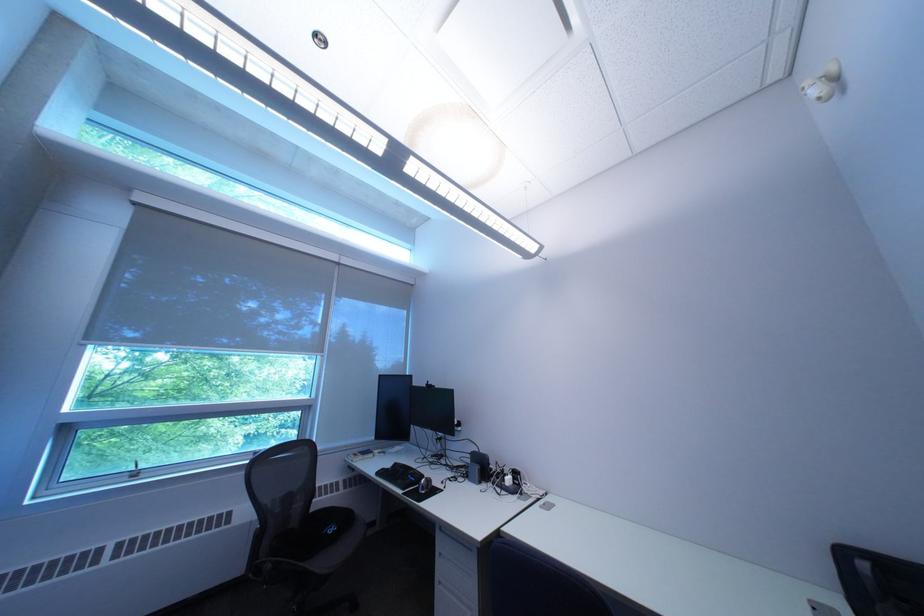
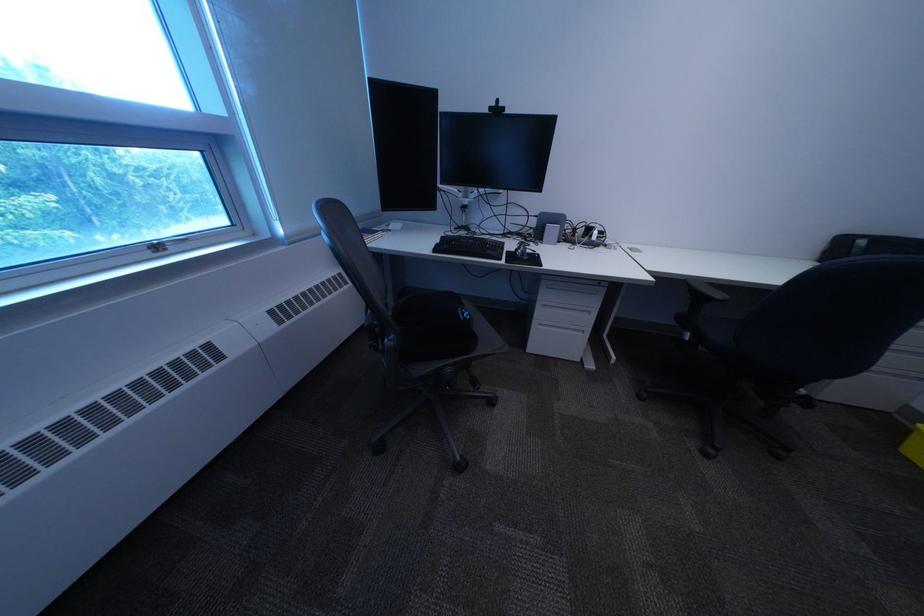
In the second image, find the point that corresponds to (456,554) in the first image.

(558, 307)